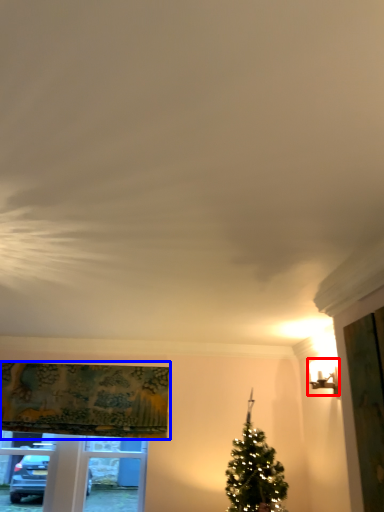
Question: Among these objects, which one is nearest to the camera, light fixture (highlighted by a red box) or curtain (highlighted by a blue box)?

Choices:
 (A) light fixture
 (B) curtain

Answer: (A)